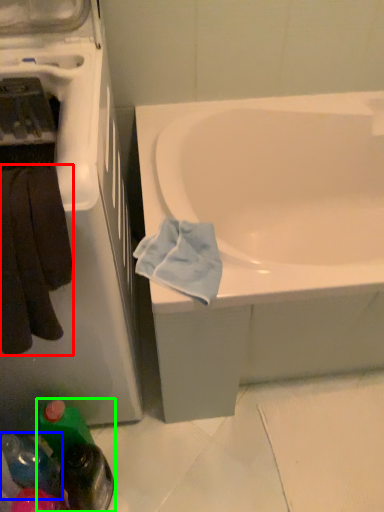
Question: Based on their relative distances, which object is nearer to towel/napkin (highlighted by a red box)? Choose from bottle (highlighted by a blue box) and bottle (highlighted by a green box).

Choices:
 (A) bottle
 (B) bottle

Answer: (B)